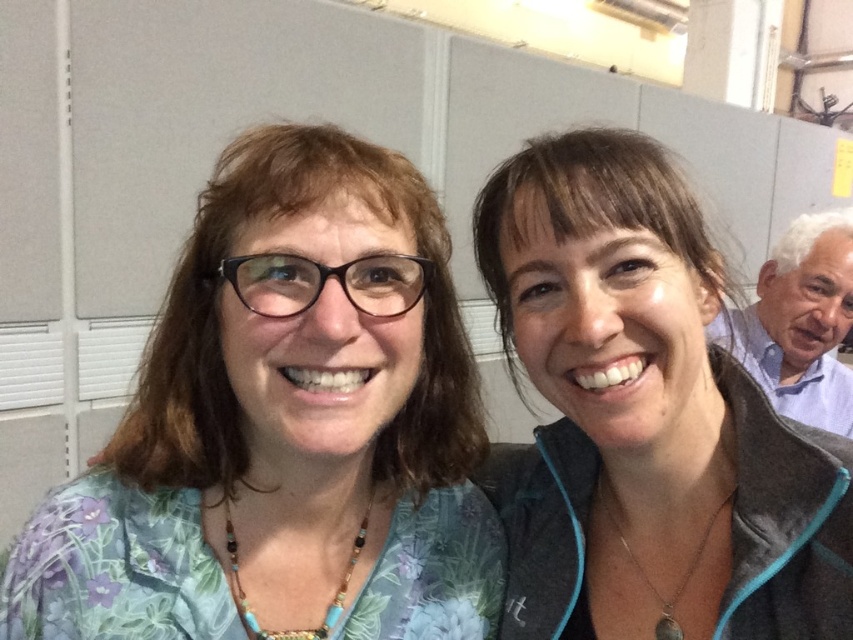
Who is higher up, floral fabric shirt at left or gray fleece jacket at upper right?

Positioned higher is gray fleece jacket at upper right.

Does floral fabric shirt at left appear on the left side of gray fleece jacket at upper right?

Correct, you'll find floral fabric shirt at left to the left of gray fleece jacket at upper right.

You are a GUI agent. You are given a task and a screenshot of the screen. Output one action in this format:
    pyautogui.click(x=<x>, y=<y>)
    Task: Click on the floral fabric shirt at left
    The width and height of the screenshot is (853, 640).
    Given the screenshot: What is the action you would take?
    pyautogui.click(x=283, y=428)

Locate an element on the screen. This screenshot has height=640, width=853. floral fabric shirt at left is located at coordinates (283, 428).

In the scene shown: Between floral fabric shirt at left and blue shirt at right, which one has less height?

Standing shorter between the two is floral fabric shirt at left.

Is point (465, 419) farther from camera compared to point (795, 390)?

No, (465, 419) is closer to viewer.

This screenshot has width=853, height=640. What do you see at coordinates (283, 428) in the screenshot?
I see `floral fabric shirt at left` at bounding box center [283, 428].

I want to click on floral fabric shirt at left, so click(283, 428).

Is gray fleece jacket at upper right below blue shirt at right?

Yes.

Identify the location of gray fleece jacket at upper right. This screenshot has width=853, height=640. (645, 419).

The height and width of the screenshot is (640, 853). I want to click on gray fleece jacket at upper right, so click(x=645, y=419).